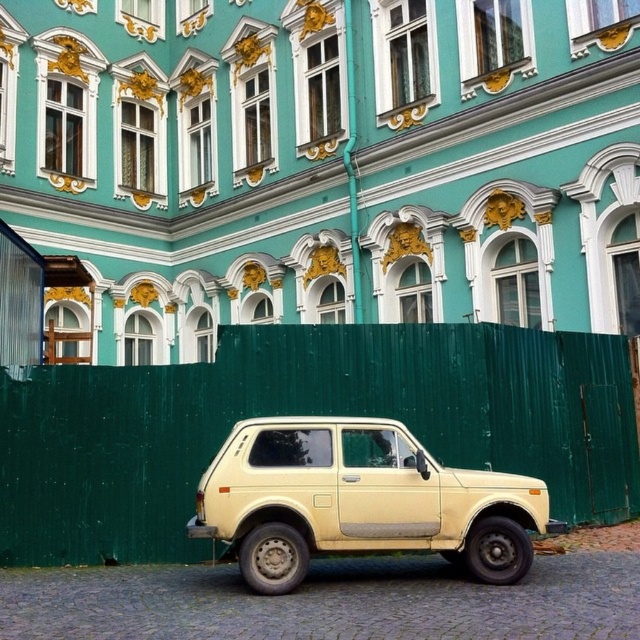
The height and width of the screenshot is (640, 640). Describe the element at coordinates (305, 413) in the screenshot. I see `green wooden fence at lower center` at that location.

Is green wooden fence at lower center below beige matte suv at center?

No.

This screenshot has width=640, height=640. Find the location of `green wooden fence at lower center`. green wooden fence at lower center is located at coordinates tap(305, 413).